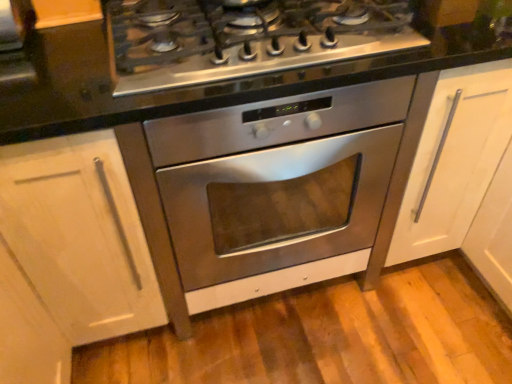
Question: Is stainless steel cooktop at center taller or shorter than stainless steel oven at center?

Choices:
 (A) short
 (B) tall

Answer: (A)

Question: Do you think stainless steel cooktop at center is within stainless steel oven at center, or outside of it?

Choices:
 (A) outside
 (B) inside

Answer: (A)

Question: Is stainless steel cooktop at center wider or thinner than stainless steel oven at center?

Choices:
 (A) wide
 (B) thin

Answer: (B)

Question: Is stainless steel oven at center taller or shorter than stainless steel cooktop at center?

Choices:
 (A) tall
 (B) short

Answer: (A)

Question: Considering their positions, is stainless steel oven at center located in front of or behind stainless steel cooktop at center?

Choices:
 (A) front
 (B) behind

Answer: (B)

Question: Does point (177, 241) appear closer or farther from the camera than point (300, 18)?

Choices:
 (A) farther
 (B) closer

Answer: (A)

Question: Is stainless steel oven at center to the left or to the right of stainless steel cooktop at center in the image?

Choices:
 (A) left
 (B) right

Answer: (B)